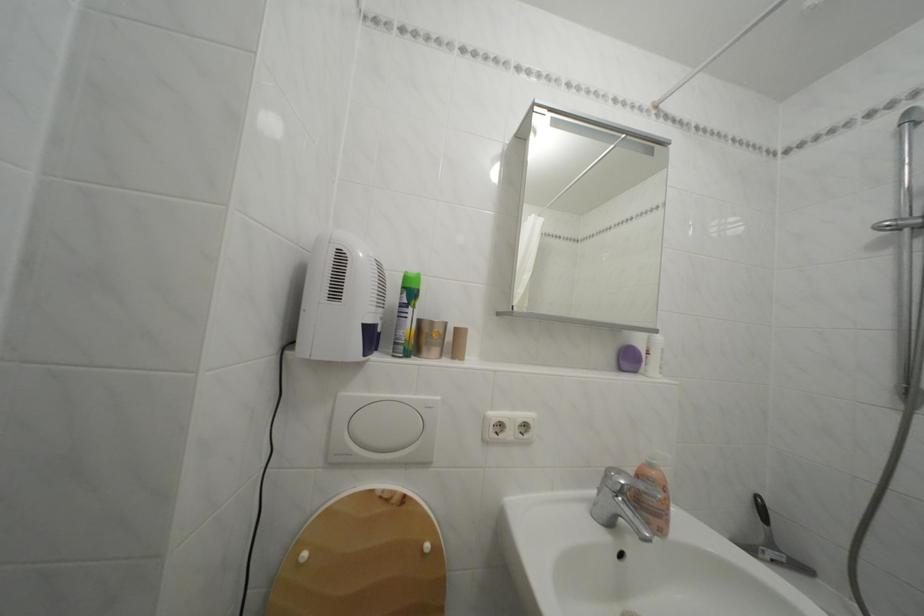
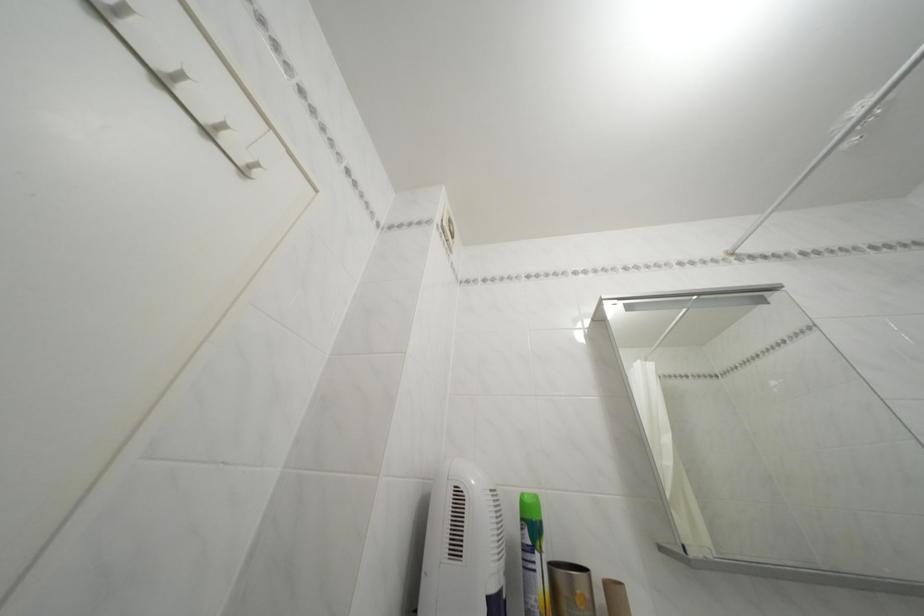
The point at (x=411, y=294) is marked in the first image. Where is the corresponding point in the second image?

(531, 525)